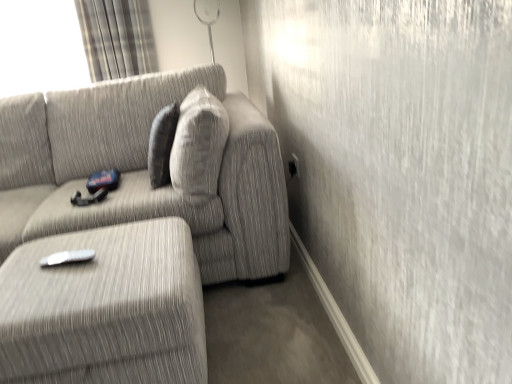
Question: Considering their positions, is plaid fabric curtain at upper left located in front of or behind white plastic remote at lower left?

Choices:
 (A) behind
 (B) front

Answer: (A)

Question: From a real-world perspective, is plaid fabric curtain at upper left above or below white plastic remote at lower left?

Choices:
 (A) below
 (B) above

Answer: (B)

Question: Considering the real-world distances, which object is farthest from the textured gray ottoman at lower left?

Choices:
 (A) plaid fabric curtain at upper left
 (B) white plastic remote at lower left
 (C) textured gray couch at center

Answer: (A)

Question: Estimate the real-world distances between objects in this image. Which object is closer to the plaid fabric curtain at upper left?

Choices:
 (A) textured gray couch at center
 (B) white plastic remote at lower left
 (C) textured gray ottoman at lower left

Answer: (A)